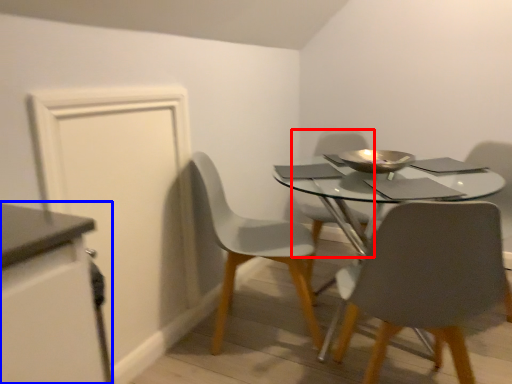
Question: Which object appears farthest to the camera in this image, chair (highlighted by a red box) or cabinetry (highlighted by a blue box)?

Choices:
 (A) chair
 (B) cabinetry

Answer: (A)